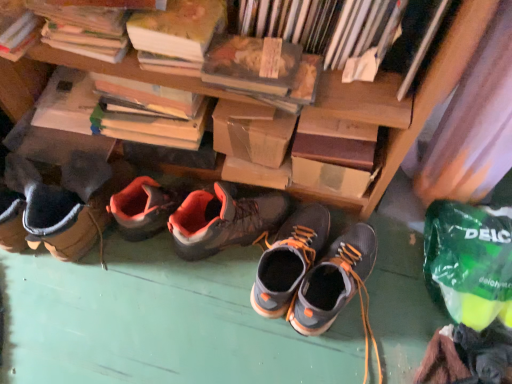
Question: From a real-world perspective, relative to matte gray and orange hiking boots at center, acting as the 1th footwear starting from the right, is orange suede hiking boots at center, positioned as the third footwear in right-to-left order, vertically above or below?

Choices:
 (A) above
 (B) below

Answer: (A)

Question: Would you say orange suede hiking boots at center, positioned as the third footwear in right-to-left order, is inside or outside matte gray and orange hiking boots at center, the 3th footwear when ordered from left to right?

Choices:
 (A) outside
 (B) inside

Answer: (A)

Question: Based on their relative distances, which object is farther from the orange suede hiking boots at center, which ranks as the 1th footwear in left-to-right order?

Choices:
 (A) hardcover book at upper right, arranged as the first book when viewed from the right
 (B) brown cardboard box at upper center, placed as the second book when sorted from right to left
 (C) dark gray suede shoes at center, which appears as the second footwear when viewed from the right
 (D) matte gray and orange hiking boots at center, acting as the 1th footwear starting from the right
 (E) hardcover book at upper left, which is counted as the first book, starting from the left

Answer: (E)

Question: Estimate the real-world distances between objects in this image. Which object is closer to the hardcover book at upper left, the third book when ordered from right to left?

Choices:
 (A) orange suede hiking boots at center, positioned as the third footwear in right-to-left order
 (B) hardcover book at upper right, arranged as the first book when viewed from the right
 (C) hardcover book at upper center
 (D) hardcover book at upper left, which is counted as the first book, starting from the left
 (E) dark gray suede shoes at center, placed as the second footwear when sorted from left to right

Answer: (C)